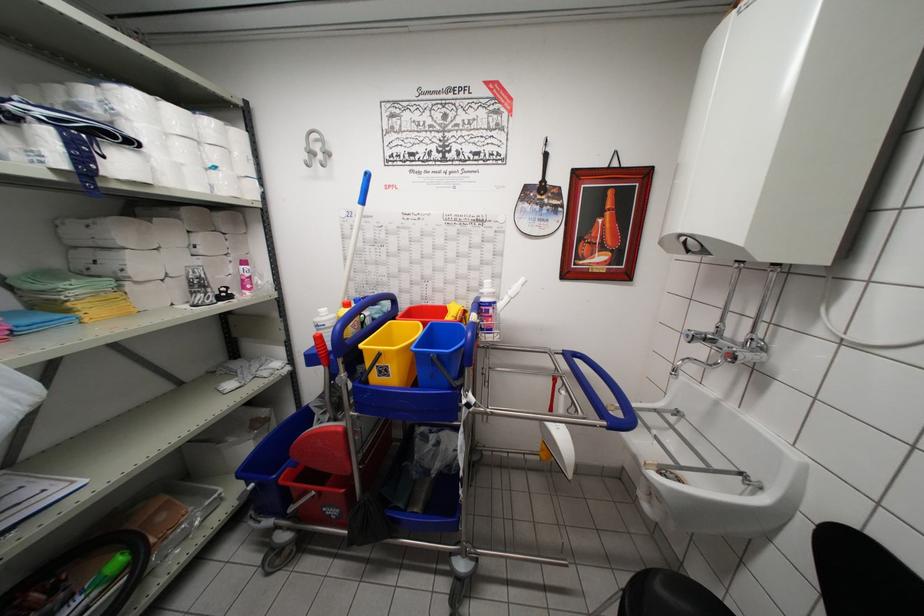
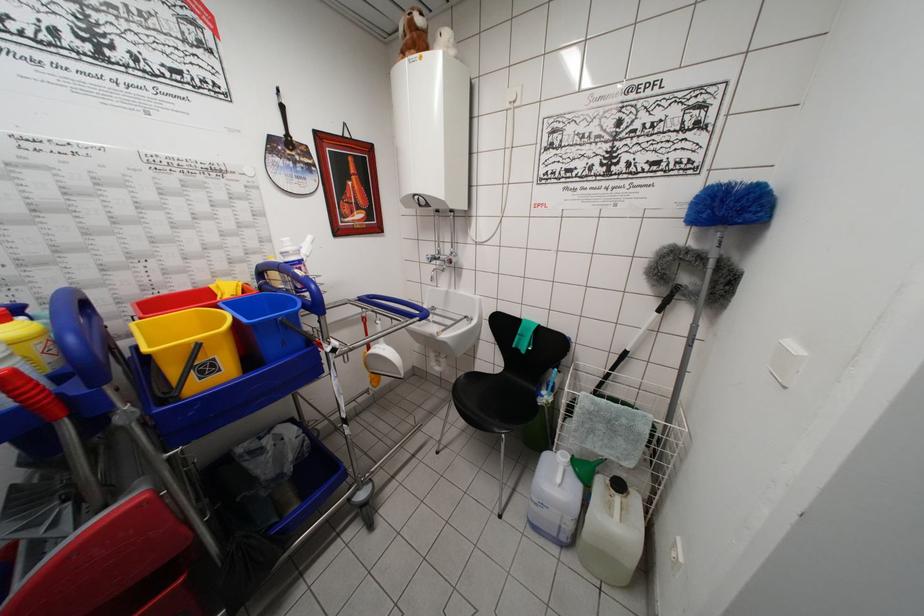
Find the pixel in the second image that matches the point at 439,361 in the first image.

(287, 323)